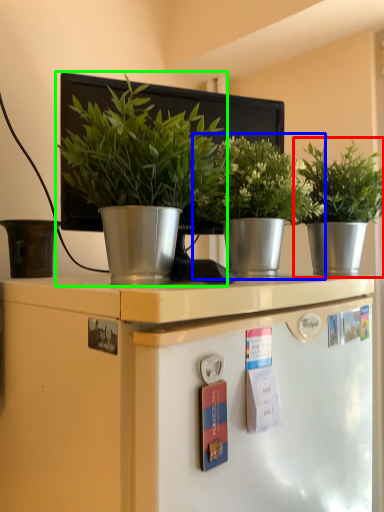
Question: Estimate the real-world distances between objects in this image. Which object is farther from houseplant (highlighted by a red box), houseplant (highlighted by a blue box) or houseplant (highlighted by a green box)?

Choices:
 (A) houseplant
 (B) houseplant

Answer: (B)